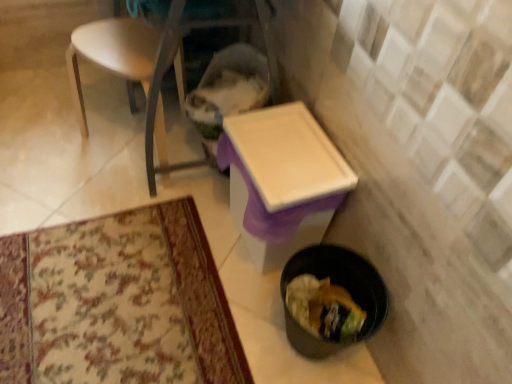
Question: Can you confirm if black plastic trash can at lower right is smaller than white plastic table at center?

Choices:
 (A) yes
 (B) no

Answer: (A)

Question: Can you confirm if black plastic trash can at lower right is wider than white plastic table at center?

Choices:
 (A) no
 (B) yes

Answer: (A)

Question: Considering the relative sizes of black plastic trash can at lower right and white plastic table at center in the image provided, is black plastic trash can at lower right thinner than white plastic table at center?

Choices:
 (A) no
 (B) yes

Answer: (B)

Question: Is black plastic trash can at lower right placed right next to white plastic table at center?

Choices:
 (A) no
 (B) yes

Answer: (A)

Question: Is the depth of black plastic trash can at lower right less than that of white plastic table at center?

Choices:
 (A) no
 (B) yes

Answer: (B)

Question: Is white plastic chair at upper left situated inside black plastic trash can at lower right or outside?

Choices:
 (A) inside
 (B) outside

Answer: (B)

Question: Is point (97, 44) positioned closer to the camera than point (312, 269)?

Choices:
 (A) farther
 (B) closer

Answer: (A)

Question: Looking at the image, does white plastic chair at upper left seem bigger or smaller compared to black plastic trash can at lower right?

Choices:
 (A) big
 (B) small

Answer: (A)

Question: From a real-world perspective, is white plastic chair at upper left positioned above or below black plastic trash can at lower right?

Choices:
 (A) below
 (B) above

Answer: (B)

Question: From a real-world perspective, is white plastic table at center above or below black plastic trash can at lower right?

Choices:
 (A) above
 (B) below

Answer: (A)

Question: In terms of size, does white plastic table at center appear bigger or smaller than black plastic trash can at lower right?

Choices:
 (A) small
 (B) big

Answer: (B)

Question: Is white plastic table at center in front of or behind black plastic trash can at lower right in the image?

Choices:
 (A) front
 (B) behind

Answer: (B)

Question: Which is correct: white plastic table at center is inside black plastic trash can at lower right, or outside of it?

Choices:
 (A) outside
 (B) inside

Answer: (A)

Question: From a real-world perspective, is black plastic trash can at lower right above or below white plastic chair at upper left?

Choices:
 (A) above
 (B) below

Answer: (B)

Question: Considering the positions of point (295, 329) and point (155, 54), is point (295, 329) closer or farther from the camera than point (155, 54)?

Choices:
 (A) farther
 (B) closer

Answer: (B)